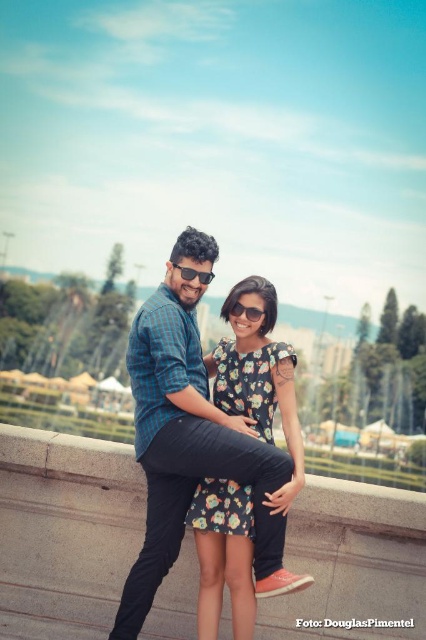
You are a photographer trying to capture the best shot of the two people on the bridge. You notice the sunglasses at center and the black plastic sunglasses at upper center. Which pair of sunglasses has a smaller width?

The sunglasses at center has a smaller width than the black plastic sunglasses at upper center.

Consider the image. You are a photographer trying to capture the best shot of the two people on the bridge. You notice the sunglasses at center and the black plastic sunglasses at upper center. Which pair of sunglasses is taller?

The black plastic sunglasses at upper center is taller than the sunglasses at center.